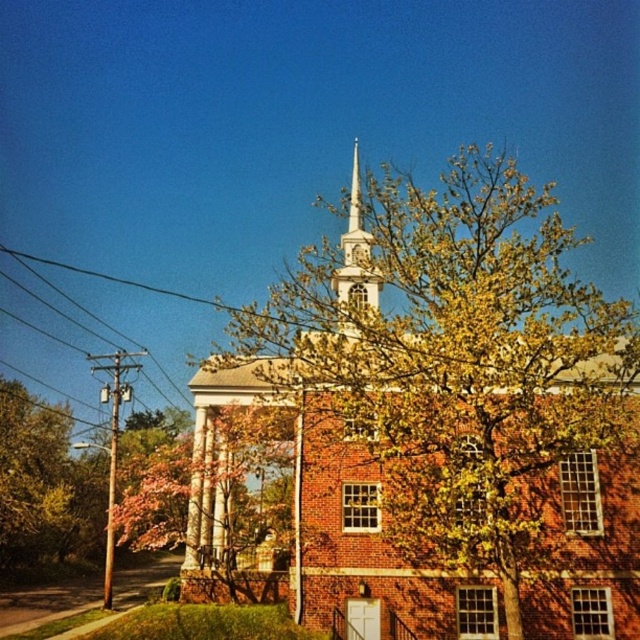
Is green leafy tree at center shorter than white steeple at center?

In fact, green leafy tree at center may be taller than white steeple at center.

Between green leafy tree at center and white steeple at center, which one appears on the left side from the viewer's perspective?

white steeple at center is more to the left.

Does point (436, 557) lie behind point (356, 205)?

No, it is in front of (356, 205).

Identify the location of green leafy tree at center. Image resolution: width=640 pixels, height=640 pixels. (451, 410).

Can you confirm if green leafy tree at left is positioned below white steeple at center?

Correct, green leafy tree at left is located below white steeple at center.

Who is more forward, (x=38, y=561) or (x=358, y=170)?

Point (x=38, y=561) is in front.

Is point (48, 436) positioned after point (360, 266)?

Yes, point (48, 436) is farther from viewer.

The height and width of the screenshot is (640, 640). I want to click on green leafy tree at left, so click(33, 481).

Consider the image. Does green leafy tree at center appear on the right side of green leafy tree at left?

Yes, green leafy tree at center is to the right of green leafy tree at left.

Between green leafy tree at center and green leafy tree at left, which one has more height?

With more height is green leafy tree at center.

What are the coordinates of `green leafy tree at center` in the screenshot? It's located at point(451,410).